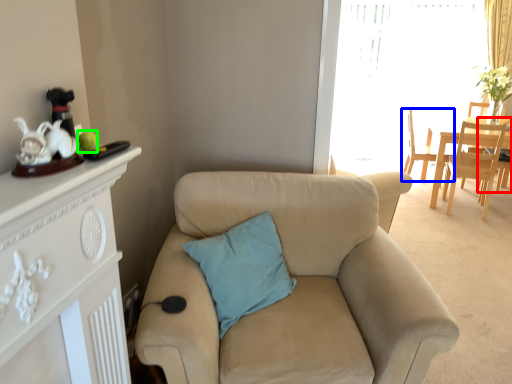
Question: Which is nearer to the armchair (highlighted by a red box)? chair (highlighted by a blue box) or teal (highlighted by a green box).

Choices:
 (A) chair
 (B) teal

Answer: (A)